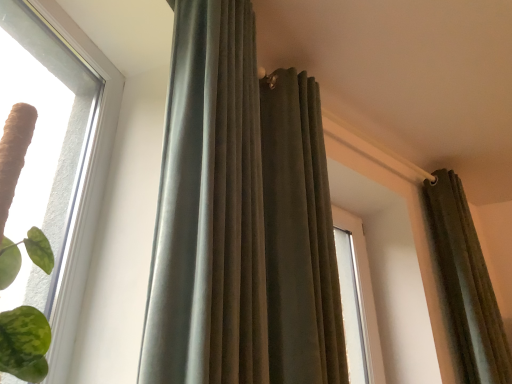
Question: Looking at the image, does clear glass window at upper left seem bigger or smaller compared to velvet olive curtain at upper right, which is the 3th curtain in left-to-right order?

Choices:
 (A) small
 (B) big

Answer: (A)

Question: Is clear glass window at upper left in front of or behind velvet olive curtain at upper right, which is the 3th curtain in left-to-right order, in the image?

Choices:
 (A) front
 (B) behind

Answer: (A)

Question: Which of these objects is positioned farthest from the velvet olive curtain at upper center, positioned as the 2th curtain in left-to-right order?

Choices:
 (A) velvet-like gray curtain at center, the 1th curtain viewed from the left
 (B) clear glass window at upper left
 (C) velvet olive curtain at upper right, which is the 3th curtain in left-to-right order

Answer: (C)

Question: Considering the real-world distances, which object is closest to the clear glass window at upper left?

Choices:
 (A) velvet olive curtain at upper right, which appears as the 1th curtain when viewed from the right
 (B) velvet-like gray curtain at center, the 1th curtain viewed from the left
 (C) velvet olive curtain at upper center, arranged as the 2th curtain when viewed from the right

Answer: (B)